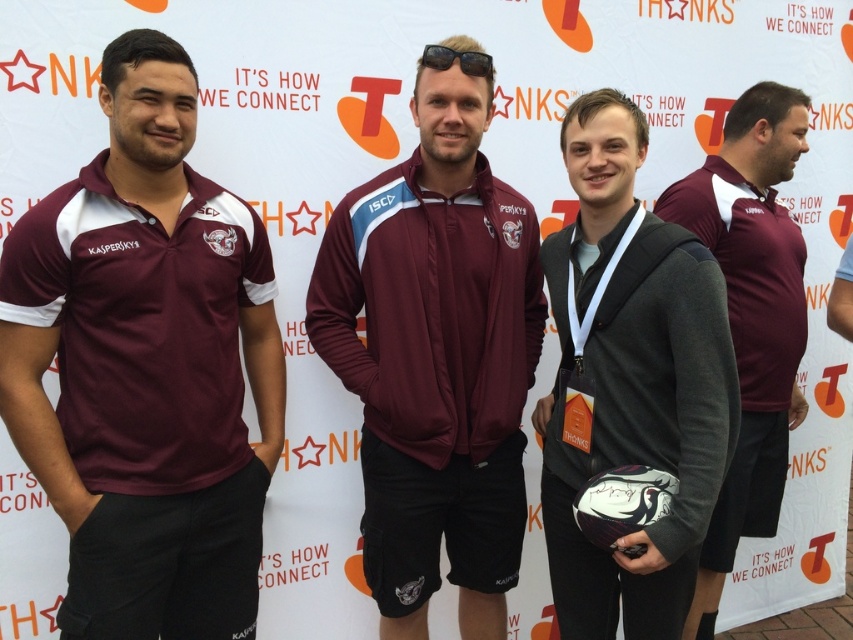
Question: Observing the image, what is the correct spatial positioning of maroon fabric polo shirt at left in reference to black plastic sunglasses at center?

Choices:
 (A) above
 (B) below

Answer: (B)

Question: From the image, what is the correct spatial relationship of maroon jersey at center in relation to black plastic sunglasses at center?

Choices:
 (A) left
 (B) right

Answer: (B)

Question: Which of the following is the farthest from the observer?

Choices:
 (A) maroon fabric polo shirt at left
 (B) maroon fabric jacket at center
 (C) black plastic sunglasses at center

Answer: (B)

Question: Among these objects, which one is farthest from the camera?

Choices:
 (A) maroon jersey at center
 (B) maroon fabric polo shirt at left
 (C) black plastic sunglasses at center

Answer: (C)

Question: Which of the following is the farthest from the observer?

Choices:
 (A) maroon jersey at right
 (B) black plastic sunglasses at center

Answer: (A)

Question: Can you confirm if maroon jersey at right is wider than black plastic sunglasses at center?

Choices:
 (A) yes
 (B) no

Answer: (A)